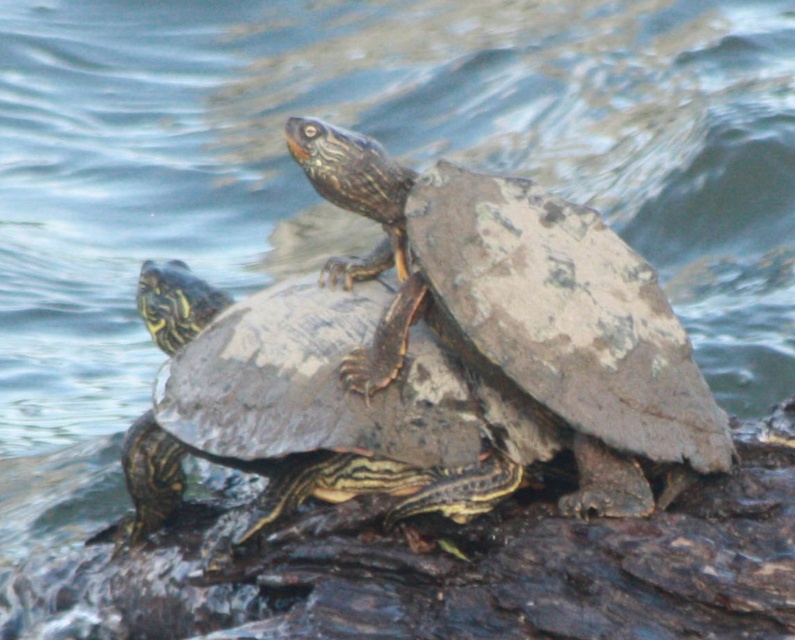
Question: Is camouflage-patterned shell at center behind patterned shell turtle at center?

Choices:
 (A) yes
 (B) no

Answer: (B)

Question: Can you confirm if camouflage-patterned shell at center is positioned below patterned shell turtle at center?

Choices:
 (A) no
 (B) yes

Answer: (A)

Question: Can you confirm if camouflage-patterned shell at center is wider than patterned shell turtle at center?

Choices:
 (A) yes
 (B) no

Answer: (B)

Question: Which object is farther from the camera taking this photo?

Choices:
 (A) patterned shell turtle at center
 (B) camouflage-patterned shell at center

Answer: (A)